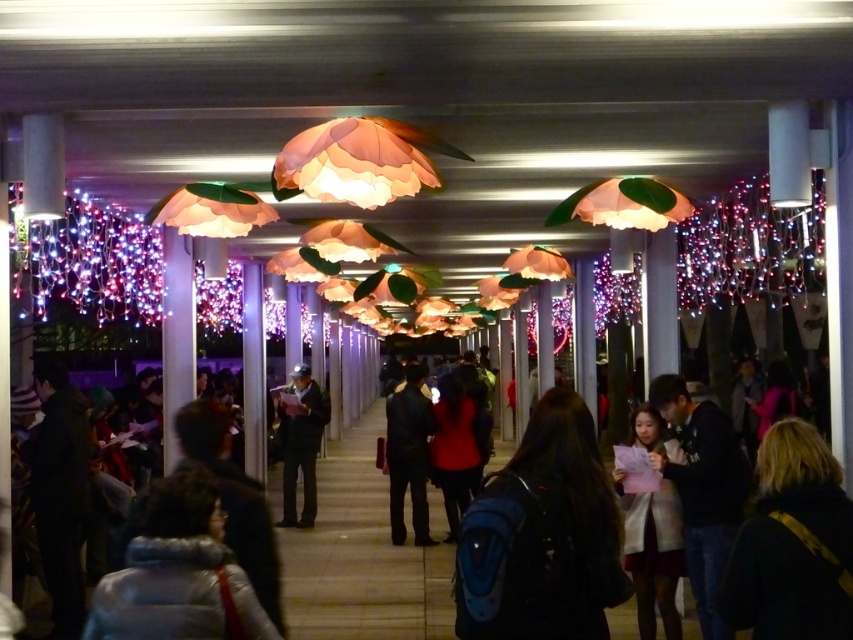
Question: Is blue backpack at center to the left of white matte coat at center from the viewer's perspective?

Choices:
 (A) yes
 (B) no

Answer: (A)

Question: Which object appears closest to the camera in this image?

Choices:
 (A) blonde hair at center
 (B) blue backpack at center
 (C) dark blue leather jacket at center
 (D) dark blue fabric jacket at center

Answer: (B)

Question: Which of the following is the closest to the observer?

Choices:
 (A) white puffy jacket at lower left
 (B) blonde hair at center

Answer: (A)

Question: Can you confirm if blue backpack at center is wider than blonde hair at center?

Choices:
 (A) no
 (B) yes

Answer: (B)

Question: Among these points, which one is nearest to the camera?

Choices:
 (A) (578, 593)
 (B) (415, 445)
 (C) (131, 540)

Answer: (A)

Question: Where is blue backpack at center located in relation to blonde hair at center in the image?

Choices:
 (A) left
 (B) right

Answer: (A)